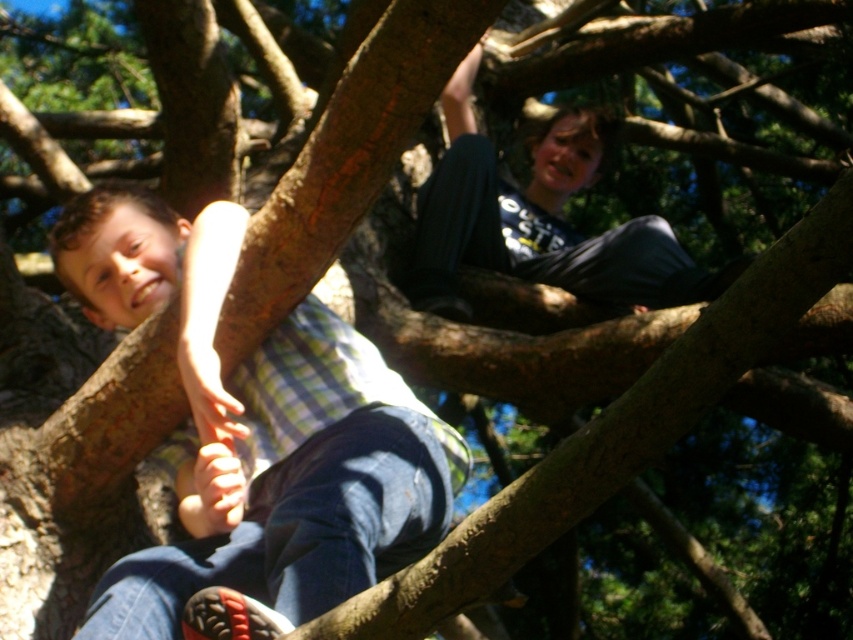
Does checkered fabric shirt at center have a greater height compared to brown rough tree branch at upper center?

Yes.

Is checkered fabric shirt at center wider than brown rough tree branch at upper center?

Indeed, checkered fabric shirt at center has a greater width compared to brown rough tree branch at upper center.

Between point (129, 620) and point (392, 616), which one is positioned in front?

Point (392, 616) is more forward.

Where is `checkered fabric shirt at center`? checkered fabric shirt at center is located at coordinates click(258, 429).

Locate an element on the screen. The height and width of the screenshot is (640, 853). brown rough tree branch at upper center is located at coordinates (611, 435).

How distant is brown rough tree branch at upper center from dark gray cotton pants at upper center?

2.54 meters

Is point (784, 307) more distant than point (521, 200)?

No.

Locate an element on the screen. brown rough tree branch at upper center is located at coordinates (611, 435).

From the picture: Between checkered fabric shirt at center and dark gray cotton pants at upper center, which one appears on the left side from the viewer's perspective?

Positioned to the left is checkered fabric shirt at center.

Can you confirm if checkered fabric shirt at center is positioned below dark gray cotton pants at upper center?

Indeed, checkered fabric shirt at center is positioned under dark gray cotton pants at upper center.

Locate an element on the screen. The image size is (853, 640). checkered fabric shirt at center is located at coordinates (258, 429).

Image resolution: width=853 pixels, height=640 pixels. Find the location of `checkered fabric shirt at center`. checkered fabric shirt at center is located at coordinates (258, 429).